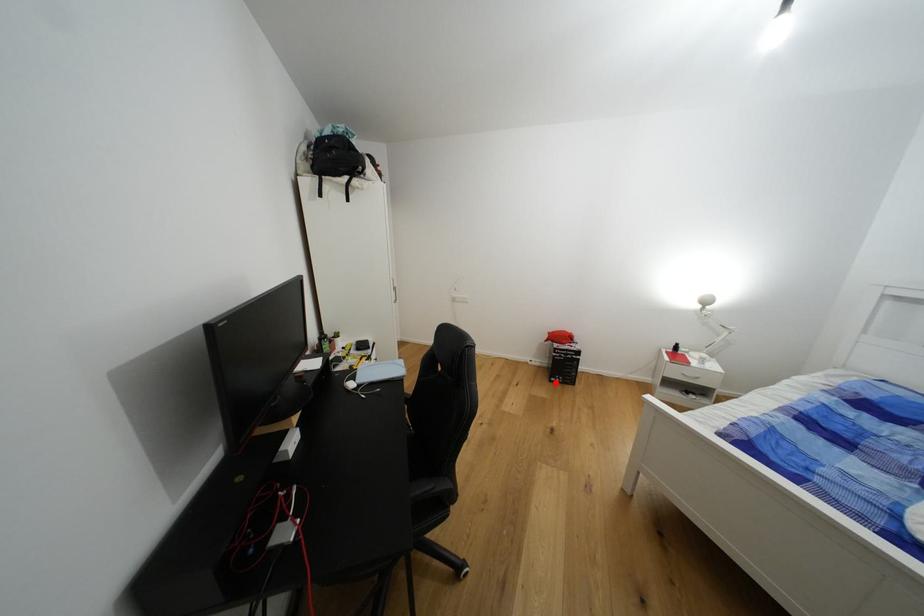
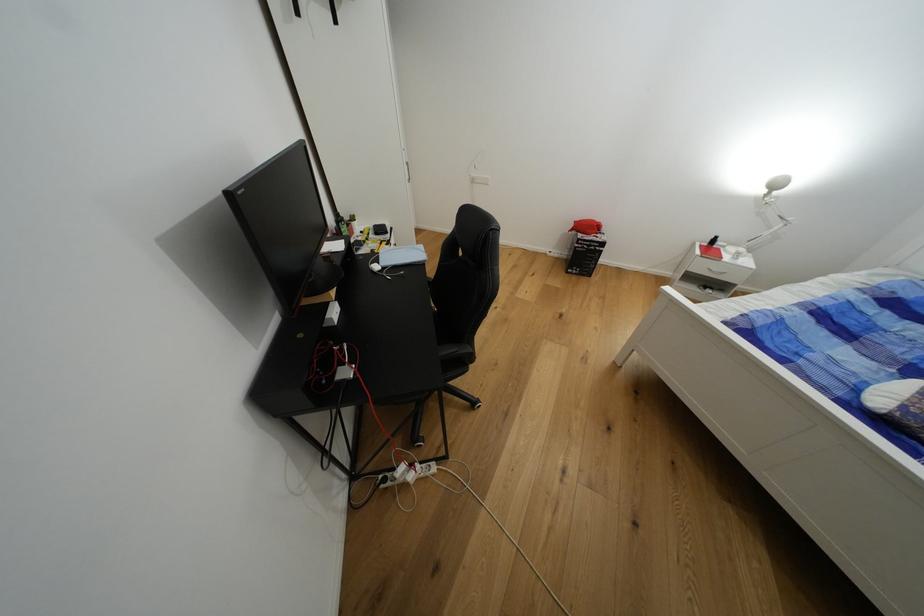
Question: I am providing you with two images of the same scene from different viewpoints. Given a red point in image1, look at the same physical point in image2. Is it:

Choices:
 (A) Closer to the viewpoint
 (B) Farther from the viewpoint

Answer: (A)